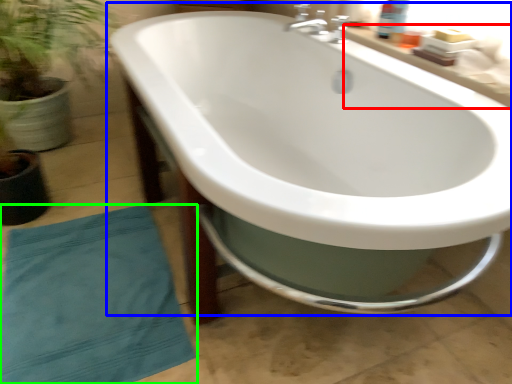
Question: Which object is the farthest from counter top (highlighted by a red box)? Choose among these: bathtub (highlighted by a blue box) or beach towel (highlighted by a green box).

Choices:
 (A) bathtub
 (B) beach towel

Answer: (B)